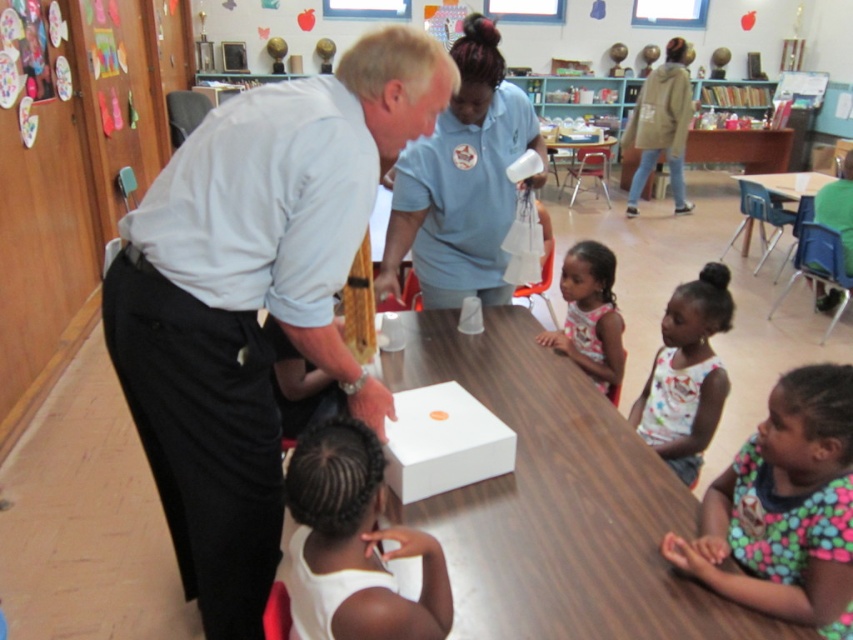
You are a photographer standing at the back of the classroom. You want to take a picture of the white matte hair at lower center. What are the coordinates where you should aim your camera?

The coordinates to aim the camera are at point (355, 544).

You are standing in the classroom and want to reach both point (438, 563) and point (592, 349). Which point should you go to first if you want to reach the one closer to you?

You should go to point (438, 563) first because it is closer to you than point (592, 349).